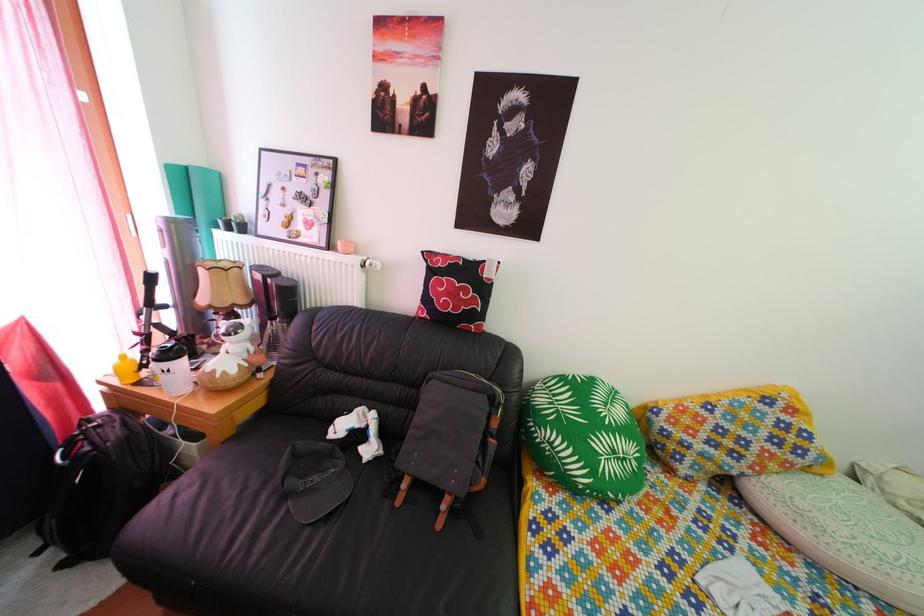
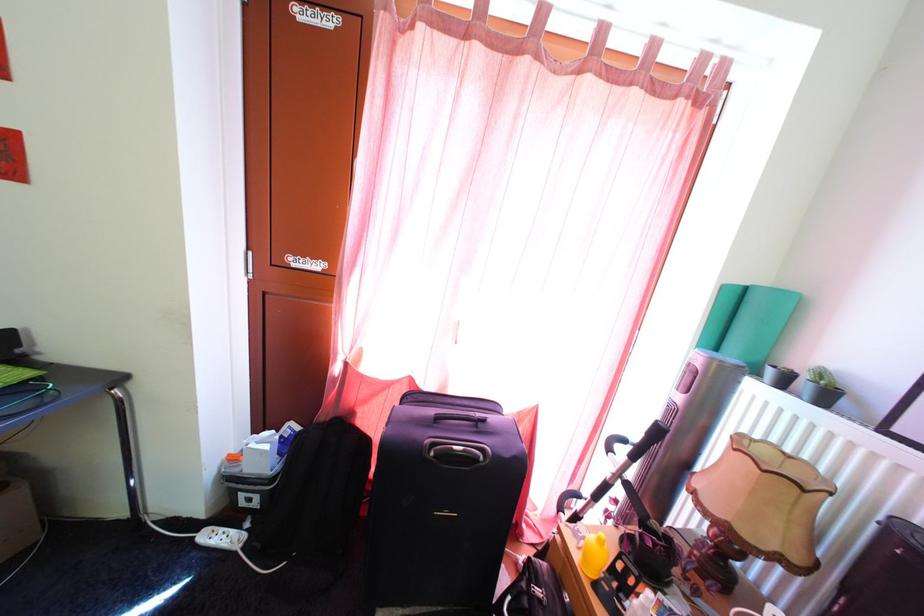
Question: The camera is either moving clockwise (left) or counter-clockwise (right) around the object. The first image is from the beginning of the video and the second image is from the end. Is the camera moving left or right when shooting the video?

Choices:
 (A) Left
 (B) Right

Answer: (B)